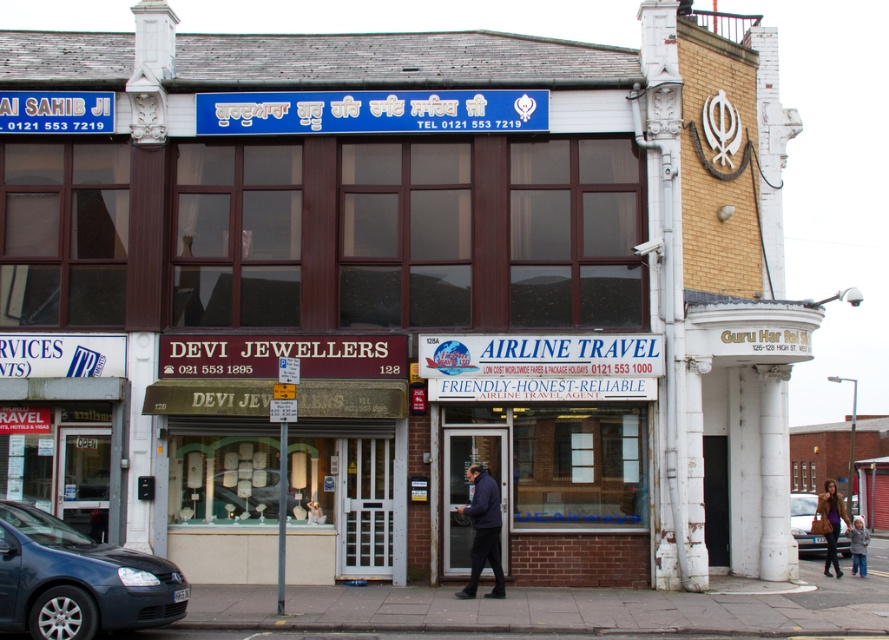
Question: Does metallic blue car at lower left appear under dark blue jacket at center?

Choices:
 (A) no
 (B) yes

Answer: (A)

Question: Can you confirm if metallic blue car at lower left is positioned to the right of brown leather coat at lower right?

Choices:
 (A) yes
 (B) no

Answer: (B)

Question: Among these points, which one is nearest to the camera?

Choices:
 (A) (801, 515)
 (B) (859, 529)
 (C) (486, 532)
 (D) (35, 577)

Answer: (D)

Question: Considering the relative positions of metallic blue car at lower left and brown leather coat at lower right in the image provided, where is metallic blue car at lower left located with respect to brown leather coat at lower right?

Choices:
 (A) left
 (B) right

Answer: (A)

Question: Which object appears farthest from the camera in this image?

Choices:
 (A) brown leather coat at lower right
 (B) light blue knit hat at lower right
 (C) dark blue jacket at center
 (D) matte brown car at lower right

Answer: (B)

Question: Which of these objects is positioned closest to the dark blue jacket at center?

Choices:
 (A) matte brown car at lower right
 (B) metallic blue car at lower left

Answer: (B)